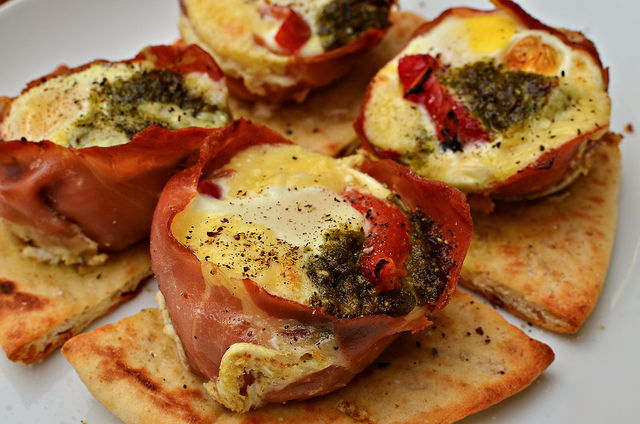
The image size is (640, 424). What are the coordinates of `plate` in the screenshot? It's located at (84, 17).